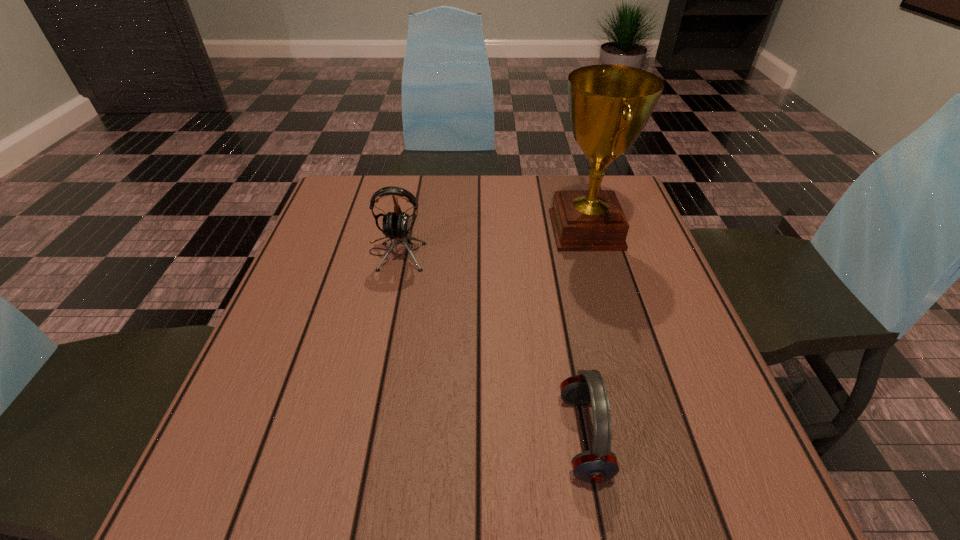
At what (x,y) coordinates should I click in order to perform the action: click on vacant space at the right edge of the desktop. Please return your answer as a coordinate pair (x, y). The height and width of the screenshot is (540, 960). Looking at the image, I should click on (636, 350).

Locate an element on the screen. This screenshot has height=540, width=960. free space at the near right corner of the desktop is located at coordinates (713, 481).

Locate an element on the screen. Image resolution: width=960 pixels, height=540 pixels. unoccupied area between the shortest object and the tallest object is located at coordinates (585, 334).

The height and width of the screenshot is (540, 960). I want to click on empty location between the tallest object and the right earphone, so click(x=585, y=334).

Identify the location of blank region between the tallest object and the nearest object. (585, 334).

The image size is (960, 540). I want to click on vacant area that lies between the tallest object and the nearer earphone, so [x=585, y=334].

Find the location of a particular element. vacant point located between the award and the taller earphone is located at coordinates (491, 241).

Locate an element on the screen. Image resolution: width=960 pixels, height=540 pixels. vacant space in between the award and the shortest object is located at coordinates (585, 334).

The width and height of the screenshot is (960, 540). I want to click on free space between the award and the nearest object, so (x=585, y=334).

You are a GUI agent. You are given a task and a screenshot of the screen. Output one action in this format:
    pyautogui.click(x=<x>, y=<y>)
    Task: Click on the free spot between the tallest object and the nearest object
    This screenshot has width=960, height=540.
    Given the screenshot: What is the action you would take?
    coord(585,334)